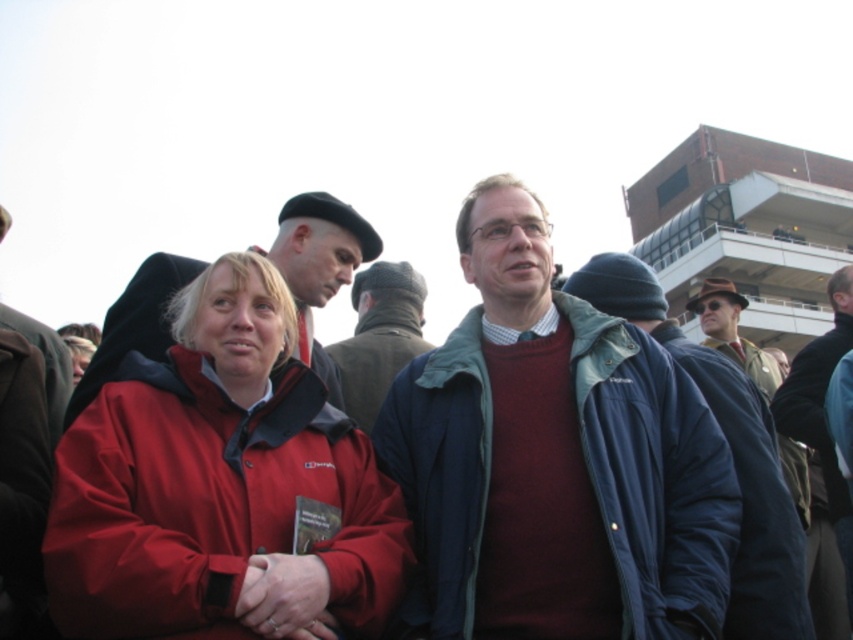
You are standing at the origin point in the image and want to reach the point labeled as point (x=733, y=316). However, there is an obstacle at point (x=795, y=436). Can you walk straight towards your destination without encountering the obstacle?

Point (x=795, y=436) is in front of point (x=733, y=316), so walking straight towards point (x=733, y=316) would first encounter the obstacle at point (x=795, y=436) before reaching the destination.

You are an event planner trying to locate two items in the image for a photo shoot. You need to place a matte black beret at upper left and a dark blue jacket at center in a new arrangement. Based on their current positions, which item is positioned higher up in the image?

The matte black beret at upper left is positioned higher up in the image than the dark blue jacket at center.

You are a photographer at the event and want to take a photo of the matte black beret at upper left without the brown leather hat at upper right appearing in the background. Is this possible given their positions?

The brown leather hat at upper right is behind the matte black beret at upper left, so yes, you can take a photo of the matte black beret at upper left without the brown leather hat at upper right appearing in the background.